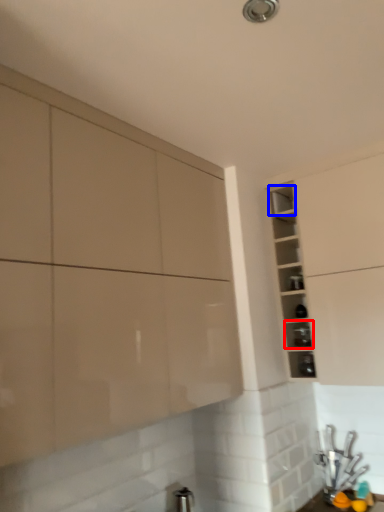
Question: Which object is further to the camera taking this photo, shelf (highlighted by a red box) or shelf (highlighted by a blue box)?

Choices:
 (A) shelf
 (B) shelf

Answer: (B)